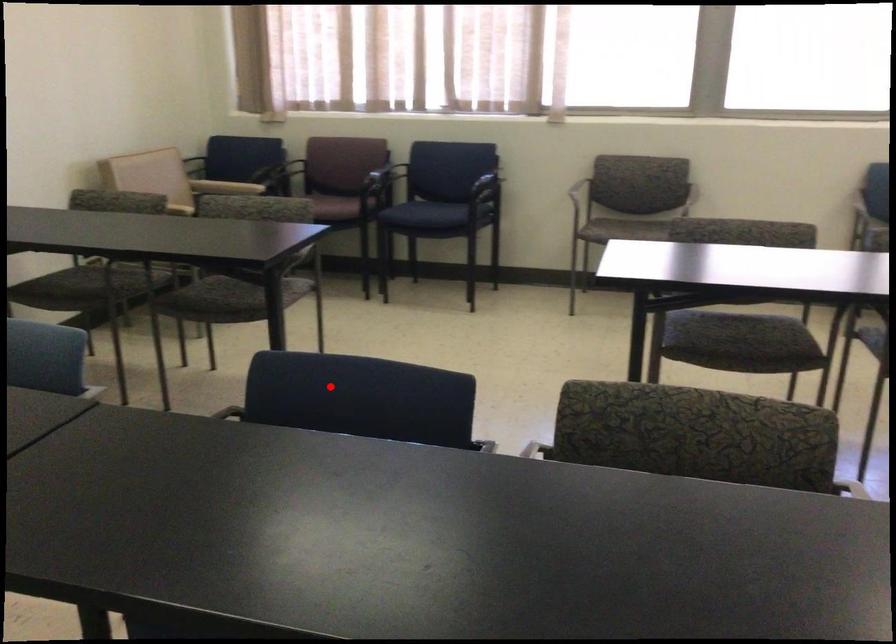
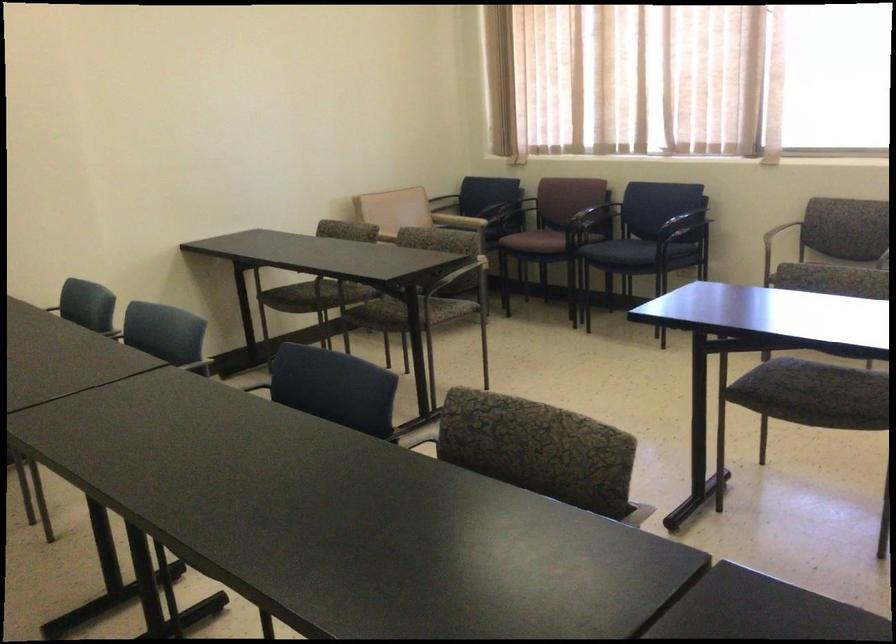
Question: I am providing you with two images of the same scene from different viewpoints. In image1, a red point is highlighted. Considering the same 3D point in image2, which of the following is correct?

Choices:
 (A) It is closer
 (B) It is farther

Answer: (B)